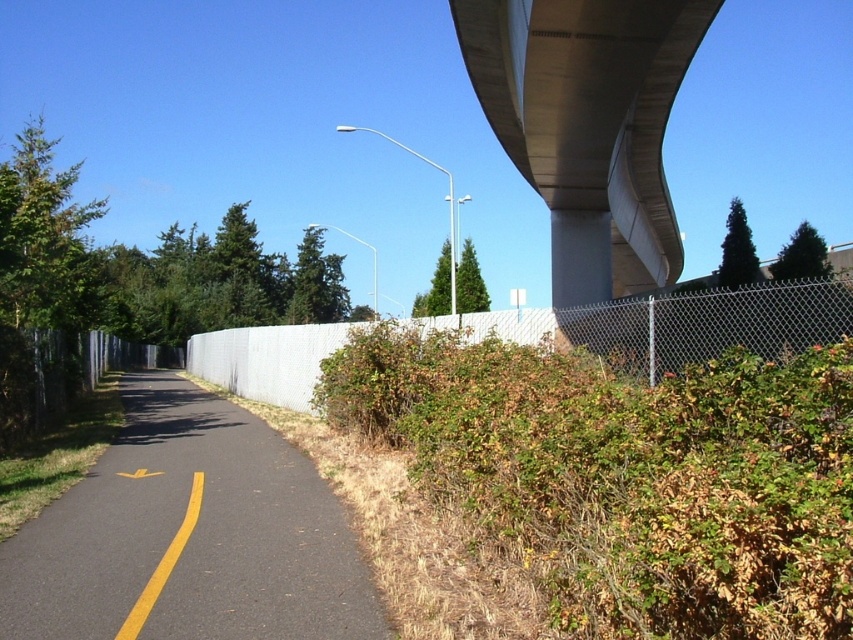
Question: Is yellow asphalt highway at lower left below white chain-link fence at center?

Choices:
 (A) no
 (B) yes

Answer: (B)

Question: Is yellow asphalt highway at lower left to the left of white chain-link fence at center from the viewer's perspective?

Choices:
 (A) no
 (B) yes

Answer: (B)

Question: Which of the following is the closest to the observer?

Choices:
 (A) (111, 636)
 (B) (723, 323)

Answer: (A)

Question: Is yellow asphalt highway at lower left below white chain-link fence at center?

Choices:
 (A) no
 (B) yes

Answer: (B)

Question: Which point appears farthest from the camera in this image?

Choices:
 (A) (306, 394)
 (B) (48, 509)

Answer: (A)